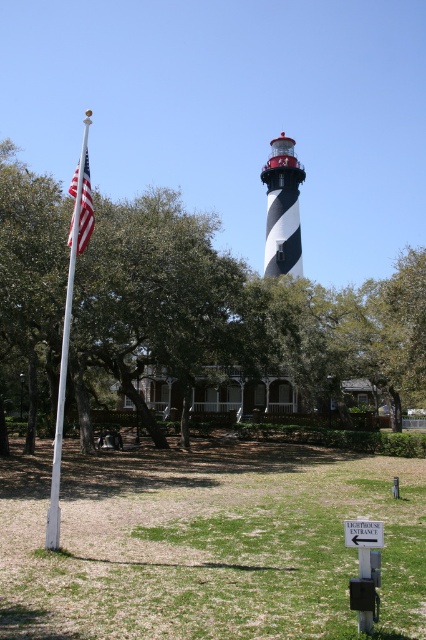
Question: Which object is positioned closest to the black and white striped lighthouse at center?

Choices:
 (A) green leafy tree at left
 (B) white painted wood flag pole at left
 (C) american flag at left

Answer: (A)

Question: Does green leafy tree at left have a greater width compared to white painted wood flag pole at left?

Choices:
 (A) yes
 (B) no

Answer: (A)

Question: Is white painted wood flag pole at left further to the viewer compared to american flag at left?

Choices:
 (A) no
 (B) yes

Answer: (A)

Question: Among these objects, which one is nearest to the camera?

Choices:
 (A) green leafy tree at left
 (B) white painted wood flag pole at left
 (C) black and white striped lighthouse at center

Answer: (B)

Question: Which is nearer to the black and white striped lighthouse at center?

Choices:
 (A) white painted wood flag pole at left
 (B) green leafy tree at left

Answer: (B)

Question: Does green leafy tree at left have a larger size compared to american flag at left?

Choices:
 (A) no
 (B) yes

Answer: (B)